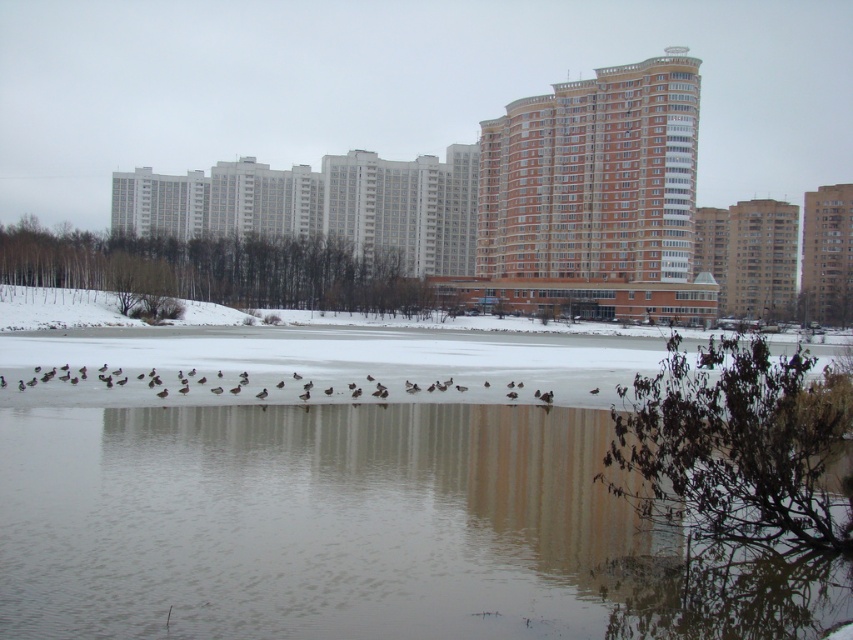
Question: Which point is closer to the camera taking this photo?

Choices:
 (A) (360, 388)
 (B) (567, 429)

Answer: (B)

Question: Does clear water at center have a larger size compared to brown matte birds at center?

Choices:
 (A) no
 (B) yes

Answer: (A)

Question: Does clear water at center appear under brown matte birds at center?

Choices:
 (A) no
 (B) yes

Answer: (B)

Question: Is clear water at center above brown matte birds at center?

Choices:
 (A) no
 (B) yes

Answer: (A)